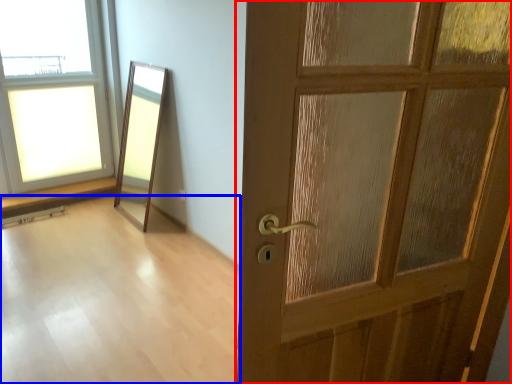
Question: Which of the following is the farthest to the observer, door (highlighted by a red box) or corridor (highlighted by a blue box)?

Choices:
 (A) door
 (B) corridor

Answer: (B)